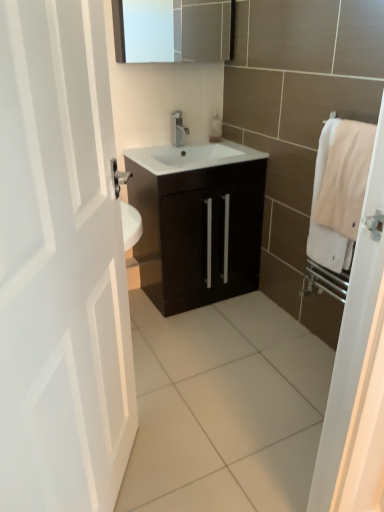
Image resolution: width=384 pixels, height=512 pixels. In order to click on free region under matte silver medicine cabinet at upper center (from a real-world perspective) in this screenshot , I will do `click(172, 144)`.